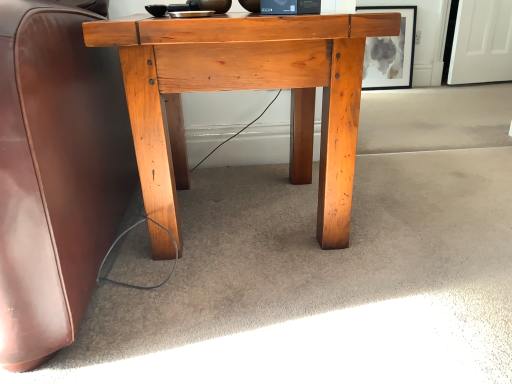
Identify the location of vacant space to the right of matte black picture frame at upper center. (422, 92).